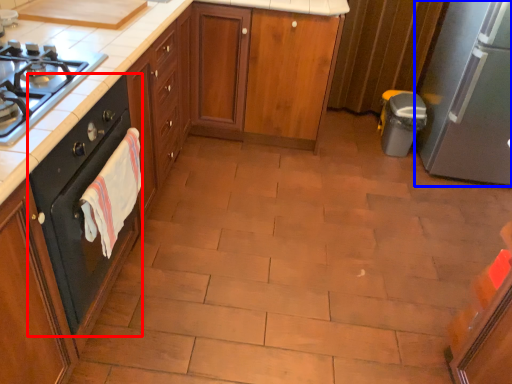
Question: Which object is closer to the camera taking this photo, home appliance (highlighted by a red box) or kitchen appliance (highlighted by a blue box)?

Choices:
 (A) home appliance
 (B) kitchen appliance

Answer: (A)